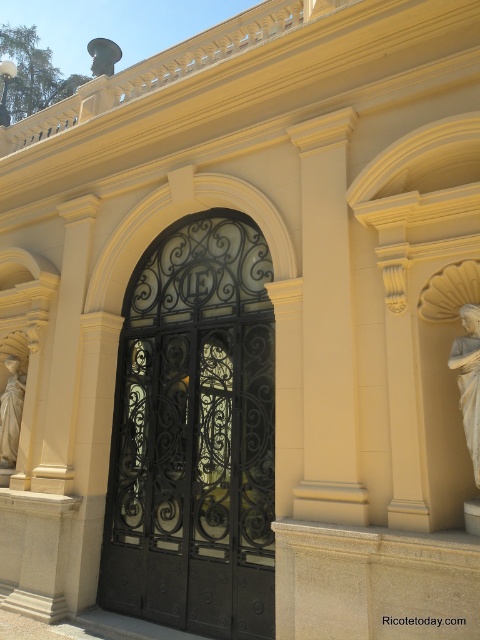
You are a delivery person trying to enter the building through the black wrought iron gate at center. The smooth cream stone column at center is blocking your path. Can you pass through the gate without moving the column?

The black wrought iron gate at center might be wider than smooth cream stone column at center, so it is possible that the gate is wide enough to allow passage while the column remains in place. However, since the exact width difference is uncertain, there is a chance the column could still obstruct the path. Further measurement or visual assessment would be needed to confirm.

You are standing in front of the building and want to take a photo of both white marble statue at right and white marble statue at left. Which statue should you move towards to include both in your camera frame?

You should move towards the white marble statue at left because the white marble statue at right is positioned on the right side of the white marble statue at left, so moving towards the left one will allow you to capture both in your frame.